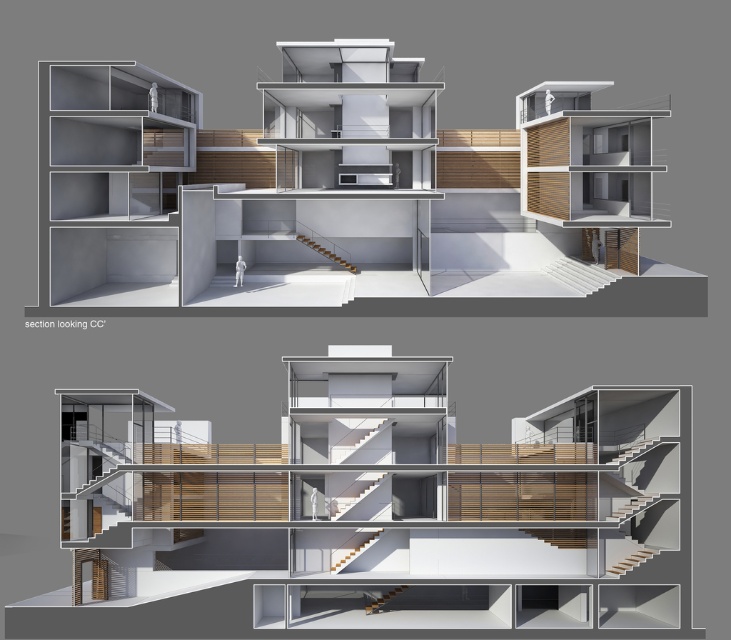
Question: Which of the following is the farthest from the observer?

Choices:
 (A) wooden stairs at center
 (B) white glossy stairs at center

Answer: (A)

Question: Is white glossy stairs at center smaller than wooden stairs at center?

Choices:
 (A) yes
 (B) no

Answer: (B)

Question: Is white glossy stairs at center positioned behind wooden stairs at center?

Choices:
 (A) no
 (B) yes

Answer: (A)

Question: Which of the following is the closest to the observer?

Choices:
 (A) click(x=317, y=252)
 (B) click(x=556, y=276)

Answer: (B)

Question: Does white glossy stairs at center come in front of wooden stairs at center?

Choices:
 (A) yes
 (B) no

Answer: (A)